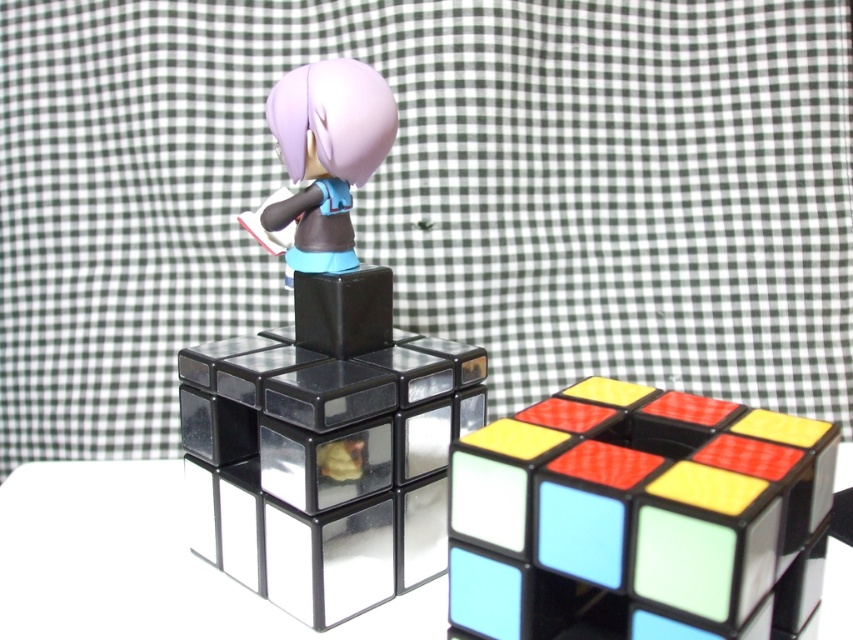
You are a photographer standing at a certain distance from the matte black figurine at center. You want to take a closeup shot of it without moving the figurine. What is the minimum distance you need to move closer to ensure the figurine fills the frame?

The matte black figurine at center is currently 32.91 inches away from the camera. To take a closeup shot, you need to move closer until the distance is reduced to the minimum focal length required for the camera to focus. However, without specific camera specifications, the exact distance can not be determined. Alternatively, adjusting the zoom settings might allow you to fill the frame without moving closer than 32.91 inches.